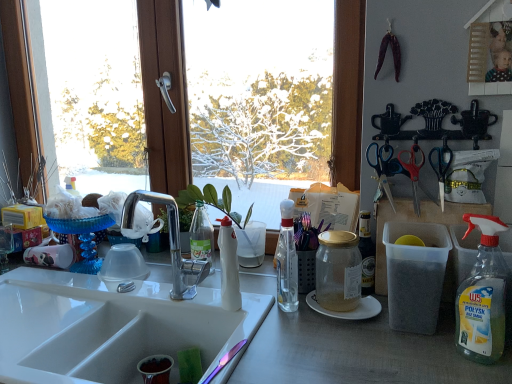
Question: Can you confirm if transparent glass window at center is smaller than white glossy sink at lower left?

Choices:
 (A) no
 (B) yes

Answer: (B)

Question: Is transparent glass window at center taller than white glossy sink at lower left?

Choices:
 (A) no
 (B) yes

Answer: (B)

Question: Considering the relative sizes of transparent glass window at center and white glossy sink at lower left in the image provided, is transparent glass window at center wider than white glossy sink at lower left?

Choices:
 (A) no
 (B) yes

Answer: (A)

Question: Is transparent glass window at center outside white glossy sink at lower left?

Choices:
 (A) yes
 (B) no

Answer: (A)

Question: From a real-world perspective, is transparent glass window at center under white glossy sink at lower left?

Choices:
 (A) no
 (B) yes

Answer: (A)

Question: Looking at the image, does red plastic scissors at upper right, which is the 2th scissors from right to left, seem bigger or smaller compared to white paper plate at center?

Choices:
 (A) big
 (B) small

Answer: (B)

Question: From a real-world perspective, is red plastic scissors at upper right, the 2th scissors in the left-to-right sequence, above or below white paper plate at center?

Choices:
 (A) above
 (B) below

Answer: (A)

Question: Considering the relative positions of red plastic scissors at upper right, which is the 2th scissors from right to left, and white paper plate at center in the image provided, is red plastic scissors at upper right, which is the 2th scissors from right to left, to the left or to the right of white paper plate at center?

Choices:
 (A) left
 (B) right

Answer: (B)

Question: Considering their positions, is red plastic scissors at upper right, the 2th scissors in the left-to-right sequence, located in front of or behind white paper plate at center?

Choices:
 (A) front
 (B) behind

Answer: (B)

Question: Is clear glass bottle at center, acting as the third bottle starting from the right, to the left or to the right of gold glass jar at center, acting as the third bottle starting from the left, in the image?

Choices:
 (A) left
 (B) right

Answer: (A)

Question: Is clear glass bottle at center, the second bottle in the left-to-right sequence, inside or outside of gold glass jar at center, the 2th bottle viewed from the right?

Choices:
 (A) inside
 (B) outside

Answer: (B)

Question: From the image's perspective, is clear glass bottle at center, the second bottle in the left-to-right sequence, located above or below gold glass jar at center, the 2th bottle viewed from the right?

Choices:
 (A) below
 (B) above

Answer: (B)

Question: In the image, is clear glass bottle at center, the second bottle in the left-to-right sequence, positioned in front of or behind gold glass jar at center, the 2th bottle viewed from the right?

Choices:
 (A) front
 (B) behind

Answer: (B)

Question: Is point (468, 278) positioned closer to the camera than point (317, 256)?

Choices:
 (A) closer
 (B) farther

Answer: (A)

Question: Would you say clear plastic bottle at right, positioned as the first bottle in right-to-left order, is to the left or to the right of gold glass jar at center, acting as the third bottle starting from the left, in the picture?

Choices:
 (A) right
 (B) left

Answer: (A)